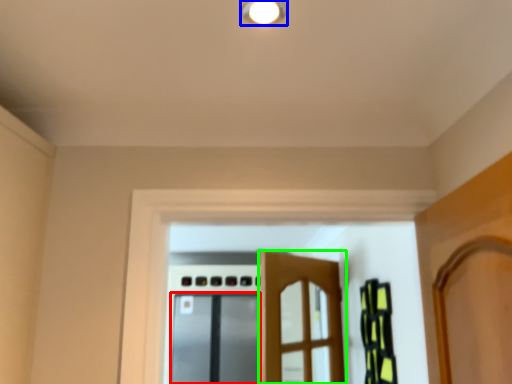
Question: Which object is the farthest from screen door (highlighted by a red box)? Choose among these: light fixture (highlighted by a blue box) or door (highlighted by a green box).

Choices:
 (A) light fixture
 (B) door

Answer: (A)